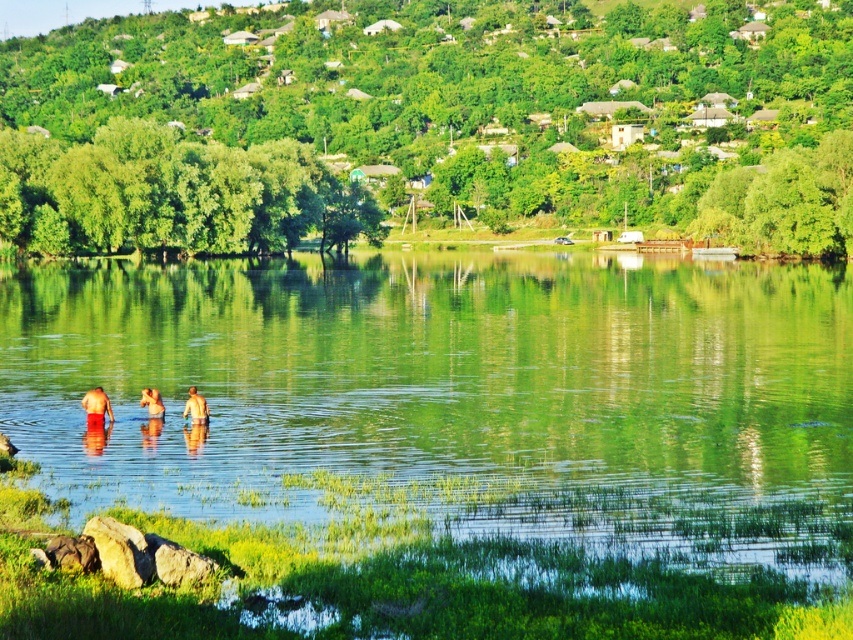
You are standing at the edge of the lake and notice a point marked at coordinates (428, 120) in the image. What does this point correspond to in the scene?

The point at coordinates (428, 120) corresponds to the green leafy hillside at upper center in the scene.

You are a photographer standing at the lakeside and want to capture a photo that includes both the green leafy hillside at upper center and the red matte shorts at lower left. Which object should you adjust your camera angle upwards to include?

To include both the green leafy hillside at upper center and the red matte shorts at lower left in the photo, you should adjust your camera angle upwards because the green leafy hillside at upper center is located above the red matte shorts at lower left.